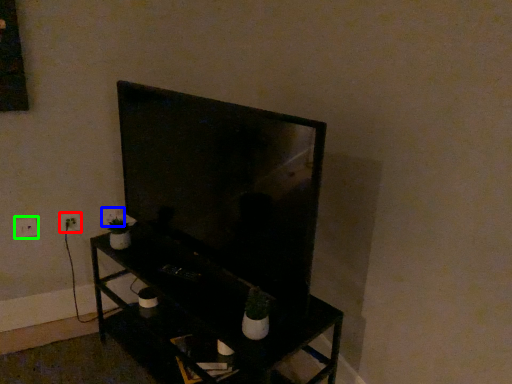
Question: Which object is positioned closest to electric outlet (highlighted by a red box)? Select from electric outlet (highlighted by a blue box) and electric outlet (highlighted by a green box).

Choices:
 (A) electric outlet
 (B) electric outlet

Answer: (B)